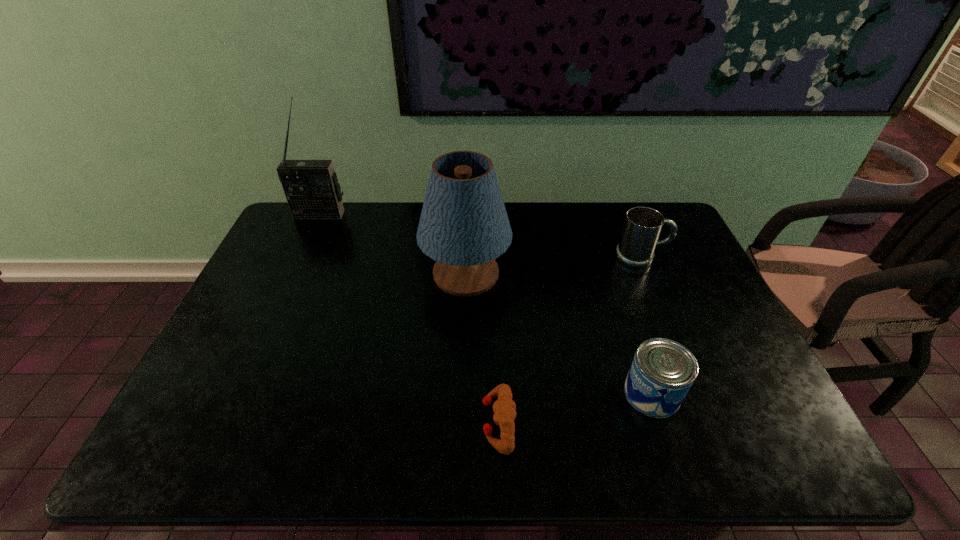
Where is `the leftmost object`? This screenshot has width=960, height=540. the leftmost object is located at coordinates (311, 187).

The height and width of the screenshot is (540, 960). Find the location of `the farthest object`. the farthest object is located at coordinates (311, 187).

Identify the location of lampshade. [464, 226].

I want to click on the third tallest object, so click(643, 225).

Locate an element on the screen. This screenshot has width=960, height=540. can is located at coordinates (662, 371).

Locate an element on the screen. the shortest object is located at coordinates tap(504, 407).

Locate an element on the screen. This screenshot has height=540, width=960. vacant space located 0.360m on the display of the leftmost object is located at coordinates (285, 292).

Identify the location of vacant area situated 0.350m on the front of the lampshade. This screenshot has height=540, width=960. (461, 418).

In order to click on free space located on the side of the mug with the handle in this screenshot , I will do `click(686, 258)`.

You are a GUI agent. You are given a task and a screenshot of the screen. Output one action in this format:
    pyautogui.click(x=<x>, y=<y>)
    Task: Click on the vacant space located 0.260m on the front label of the can
    
    Given the screenshot: What is the action you would take?
    pyautogui.click(x=516, y=393)